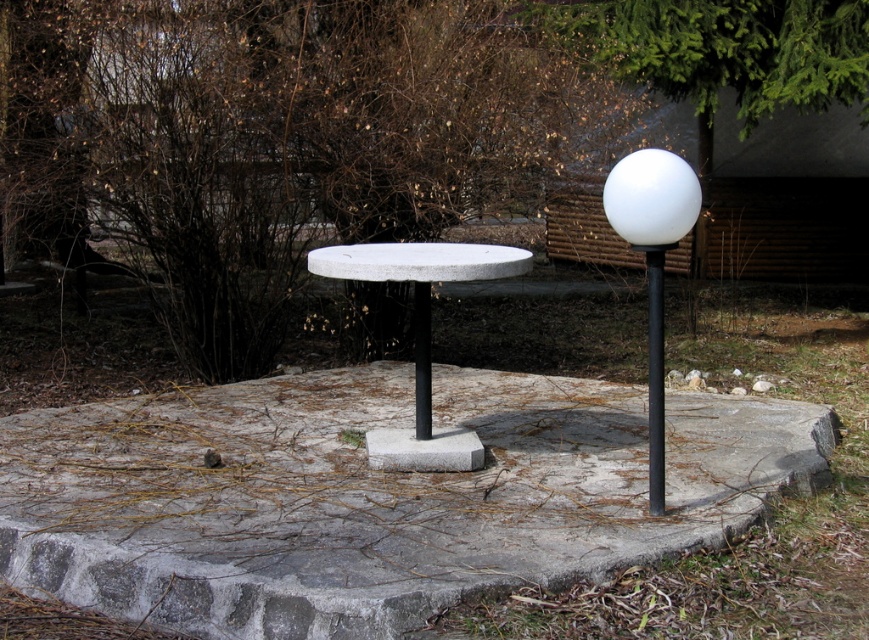
Between white glossy ball at upper right and black metal pole at right, which one has less height?

white glossy ball at upper right is shorter.

Looking at this image, is white glossy ball at upper right smaller than black metal pole at right?

Indeed, white glossy ball at upper right has a smaller size compared to black metal pole at right.

Between point (651, 442) and point (655, 292), which one is positioned behind?

Point (655, 292)

The height and width of the screenshot is (640, 869). Identify the location of white glossy ball at upper right. (652, 262).

The image size is (869, 640). What are the coordinates of `white concrete table at center` in the screenshot? It's located at (421, 337).

In the scene shown: Who is more distant from viewer, (x=357, y=259) or (x=649, y=474)?

The point (x=357, y=259) is behind.

Is point (419, 406) in front of point (649, 374)?

Yes.

At what (x,y) coordinates should I click in order to perform the action: click on white concrete table at center. Please return your answer as a coordinate pair (x, y). This screenshot has height=640, width=869. Looking at the image, I should click on (421, 337).

Who is positioned more to the left, white glossy ball at upper right or black polished pole at center?

black polished pole at center is more to the left.

Can you confirm if white glossy ball at upper right is positioned to the right of black polished pole at center?

Indeed, white glossy ball at upper right is positioned on the right side of black polished pole at center.

Locate an element on the screen. The height and width of the screenshot is (640, 869). white glossy ball at upper right is located at coordinates (652, 262).